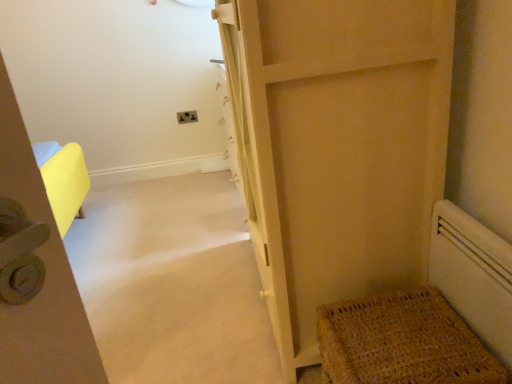
Question: Considering the relative sizes of woven brown mat at lower right and matte wood door at center in the image provided, is woven brown mat at lower right taller than matte wood door at center?

Choices:
 (A) yes
 (B) no

Answer: (B)

Question: From a real-world perspective, is woven brown mat at lower right located higher than matte wood door at center?

Choices:
 (A) no
 (B) yes

Answer: (A)

Question: From the image's perspective, is woven brown mat at lower right on matte wood door at center?

Choices:
 (A) no
 (B) yes

Answer: (A)

Question: Considering the relative sizes of woven brown mat at lower right and matte wood door at center in the image provided, is woven brown mat at lower right bigger than matte wood door at center?

Choices:
 (A) no
 (B) yes

Answer: (A)

Question: Can you confirm if woven brown mat at lower right is thinner than matte wood door at center?

Choices:
 (A) yes
 (B) no

Answer: (A)

Question: Relative to woven brown mat at lower right, is matte wood door at center in front or behind?

Choices:
 (A) behind
 (B) front

Answer: (B)

Question: Would you say matte wood door at center is inside or outside woven brown mat at lower right?

Choices:
 (A) inside
 (B) outside

Answer: (B)

Question: Is point (340, 218) closer or farther from the camera than point (471, 369)?

Choices:
 (A) closer
 (B) farther

Answer: (B)

Question: In the image, is matte wood door at center on the left side or the right side of woven brown mat at lower right?

Choices:
 (A) right
 (B) left

Answer: (B)

Question: From a real-world perspective, is woven brown mat at lower right above or below white matte radiator at lower right?

Choices:
 (A) above
 (B) below

Answer: (B)

Question: Visually, is woven brown mat at lower right positioned to the left or to the right of white matte radiator at lower right?

Choices:
 (A) right
 (B) left

Answer: (B)

Question: Does point (364, 372) appear closer or farther from the camera than point (441, 264)?

Choices:
 (A) farther
 (B) closer

Answer: (B)

Question: Considering the positions of woven brown mat at lower right and white matte radiator at lower right in the image, is woven brown mat at lower right taller or shorter than white matte radiator at lower right?

Choices:
 (A) short
 (B) tall

Answer: (A)

Question: Is matte plastic electric outlet at center inside the boundaries of woven brown mat at lower right, or outside?

Choices:
 (A) inside
 (B) outside

Answer: (B)

Question: In terms of width, does matte plastic electric outlet at center look wider or thinner when compared to woven brown mat at lower right?

Choices:
 (A) wide
 (B) thin

Answer: (B)